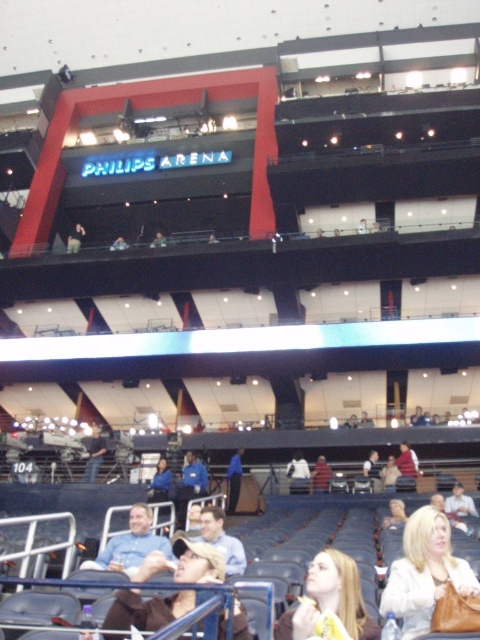
You are a photographer in the arena and want to capture a photo of the blonde hair at center without including the light brown leather jacket at lower center in the frame. Based on their positions, is this possible?

The light brown leather jacket at lower center is positioned on the left side of blonde hair at center, so if you position yourself to the right side of the blonde hair at center, you can exclude the light brown leather jacket at lower center from the frame.

You are sitting in the middle of the arena and want to locate the white leather jacket at lower right. Based on its 2D coordinates, in which direction should you look to find it?

The white leather jacket at lower right is located at coordinates point (424, 572), so you should look towards the lower right direction to find it.